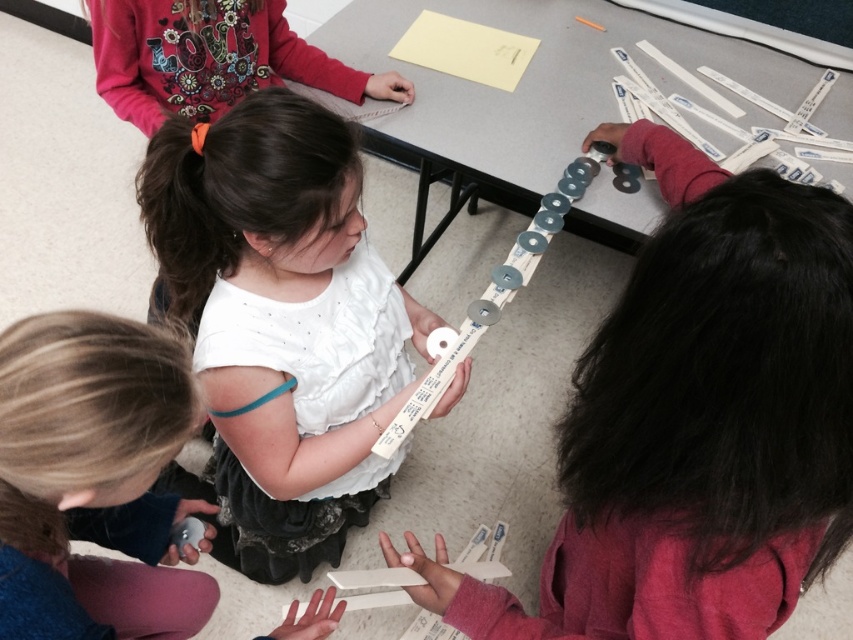
Please provide the coordinates of the white matte paper strip at upper center in the image. The coordinates should be in the format of a point with two decimal places, like point (695, 435).

The white matte paper strip at upper center is located at point (695, 435).

You are a teacher observing the children at the table. You notice the white matte tape measure at center and the white matte shirt at center. Which object is positioned to the right side of the other?

The white matte tape measure at center is to the right of the white matte shirt at center.

You are a teacher observing the children in the scene. You notice the white matte paper strip at upper center and the white matte shirt at center. Which object is positioned to the right of the other?

The white matte paper strip at upper center is to the right of the white matte shirt at center.